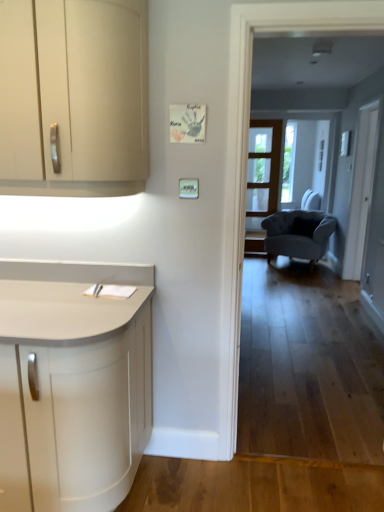
Question: Can you confirm if matte cream cabinet at left is wider than clear glass screen door at center, the second screen door positioned from the front?

Choices:
 (A) yes
 (B) no

Answer: (A)

Question: Is matte cream cabinet at left closer to camera compared to clear glass screen door at center, positioned as the first screen door in left-to-right order?

Choices:
 (A) no
 (B) yes

Answer: (B)

Question: Is matte cream cabinet at left positioned with its back to clear glass screen door at center, the second screen door positioned from the front?

Choices:
 (A) yes
 (B) no

Answer: (A)

Question: Is matte cream cabinet at left behind clear glass screen door at center, the second screen door positioned from the front?

Choices:
 (A) yes
 (B) no

Answer: (B)

Question: Does matte cream cabinet at left have a lesser height compared to clear glass screen door at center, which ranks as the 1th screen door in back-to-front order?

Choices:
 (A) yes
 (B) no

Answer: (A)

Question: In the image, is matte cream cabinet at left on the left side or the right side of velvet blue armchair at center?

Choices:
 (A) right
 (B) left

Answer: (B)

Question: Is matte cream cabinet at left taller or shorter than velvet blue armchair at center?

Choices:
 (A) short
 (B) tall

Answer: (B)

Question: In the image, is matte cream cabinet at left positioned in front of or behind velvet blue armchair at center?

Choices:
 (A) behind
 (B) front

Answer: (B)

Question: Is point (49, 154) closer or farther from the camera than point (281, 254)?

Choices:
 (A) farther
 (B) closer

Answer: (B)

Question: Is clear glass screen door at center, positioned as the first screen door in left-to-right order, wider or thinner than white glass screen door at right, marked as the 2th screen door in a left-to-right arrangement?

Choices:
 (A) wide
 (B) thin

Answer: (B)

Question: From the image's perspective, relative to white glass screen door at right, marked as the 2th screen door in a left-to-right arrangement, is clear glass screen door at center, which ranks as the 1th screen door in back-to-front order, above or below?

Choices:
 (A) below
 (B) above

Answer: (B)

Question: In terms of height, does clear glass screen door at center, positioned as the first screen door in left-to-right order, look taller or shorter compared to white glass screen door at right, the 2th screen door positioned from the back?

Choices:
 (A) tall
 (B) short

Answer: (B)

Question: Considering their positions, is clear glass screen door at center, marked as the 2th screen door in a right-to-left arrangement, located in front of or behind white glass screen door at right, marked as the 2th screen door in a left-to-right arrangement?

Choices:
 (A) front
 (B) behind

Answer: (B)

Question: In terms of size, does velvet blue armchair at center appear bigger or smaller than white glass screen door at right, the 2th screen door positioned from the back?

Choices:
 (A) small
 (B) big

Answer: (B)

Question: Is point (268, 256) positioned closer to the camera than point (372, 134)?

Choices:
 (A) closer
 (B) farther

Answer: (B)